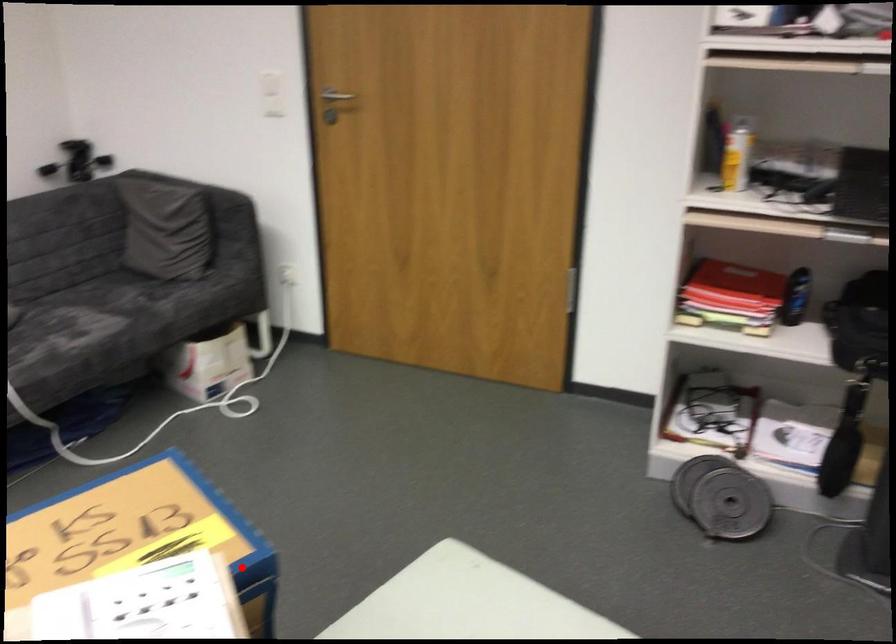
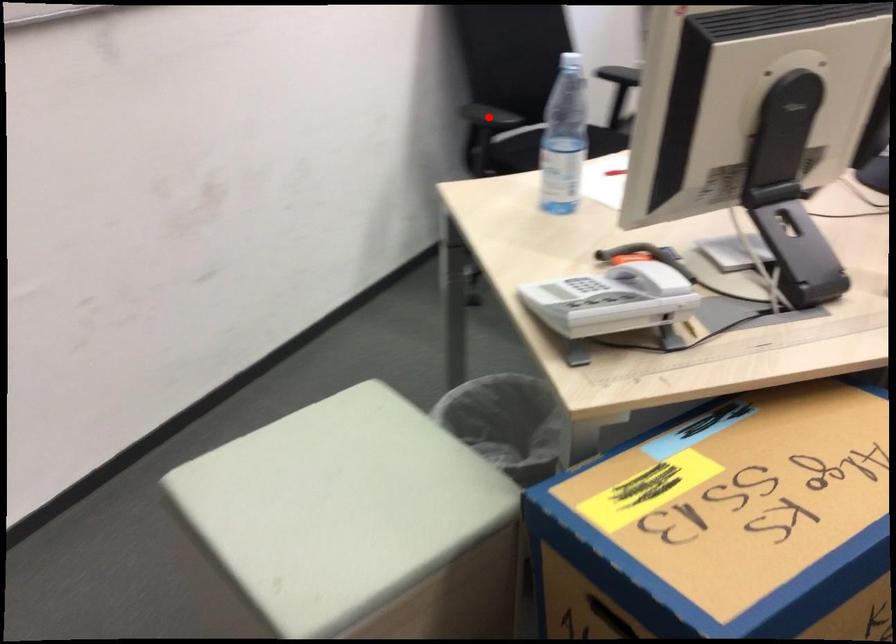
I am providing you with two images of the same scene from different viewpoints. A red point is marked on the first image and another point is marked on the second image. Do the highlighted points in image1 and image2 indicate the same real-world spot?

No